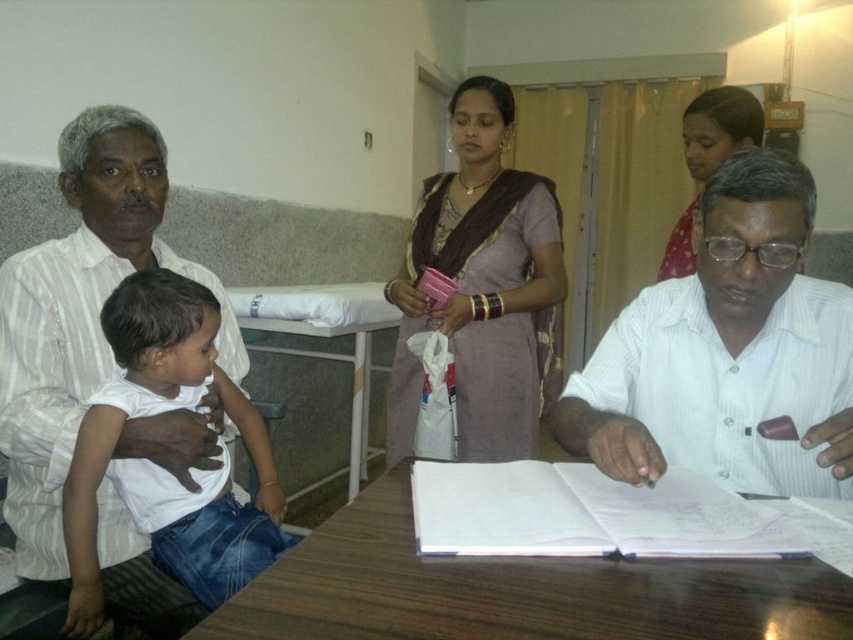
Question: Does white cotton shirt at left appear over light pink fabric saree at upper center?

Choices:
 (A) no
 (B) yes

Answer: (A)

Question: Considering the real-world distances, which object is farthest from the white paper book at center?

Choices:
 (A) white plastic table at center
 (B) purple silk saree at center

Answer: (A)

Question: Is white striped shirt at left positioned at the back of light pink fabric saree at upper center?

Choices:
 (A) yes
 (B) no

Answer: (B)

Question: Among these objects, which one is nearest to the camera?

Choices:
 (A) white plastic table at center
 (B) white cotton shirt at left
 (C) white striped shirt at center

Answer: (C)

Question: Does purple silk saree at center lie behind white cotton shirt at left?

Choices:
 (A) no
 (B) yes

Answer: (B)

Question: Which of the following is the farthest from the observer?

Choices:
 (A) white cotton shirt at left
 (B) white paper book at center
 (C) white striped shirt at center

Answer: (A)